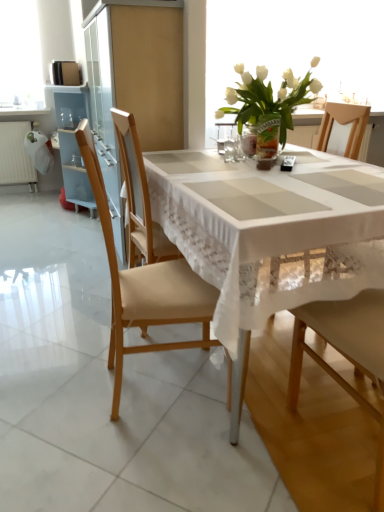
Where is `free space behind clear glass vase at center, the second tableware viewed from the left`? This screenshot has height=512, width=384. free space behind clear glass vase at center, the second tableware viewed from the left is located at coordinates (233, 154).